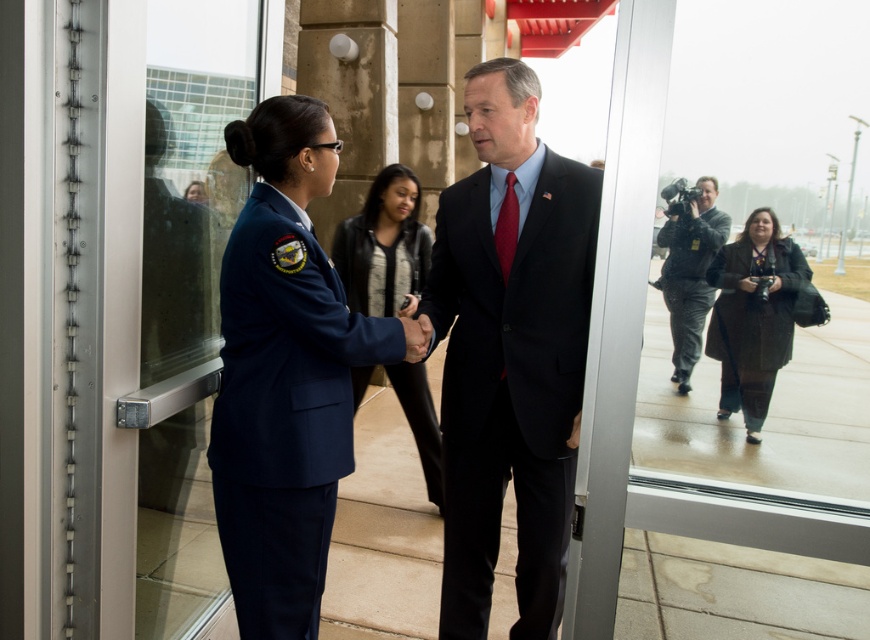
You are a photographer at the event and need to position yourself so that both the point at [186,570] and the point at [484,474] are visible in your shot. Given that you can only move forward or backward along the line connecting these two points, where should you stand to ensure both points are in frame?

To ensure both points are visible, you should position yourself behind the point at [484,474] since the point at [186,570] is behind it. This way, both points will be within your field of view when you face towards the direction of the point at [186,570].

You are a guest at this event and need to exit through the transparent glass door at left. However, you must first pass by the dark blue suit at center. Considering their heights, which one is taller?

The transparent glass door at left is taller than the dark blue suit at center, so the door is taller.